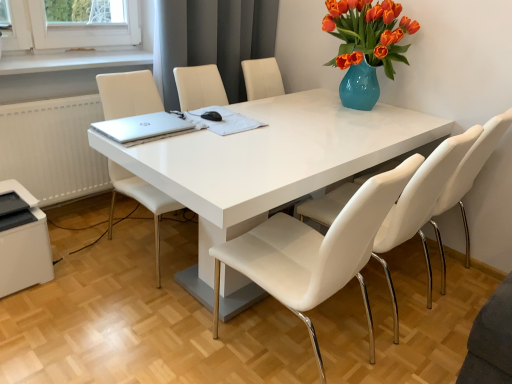
This screenshot has width=512, height=384. What are the coordinates of `free location to the left of white leather chair at center, which ranks as the second chair in left-to-right order` in the screenshot? It's located at (170, 339).